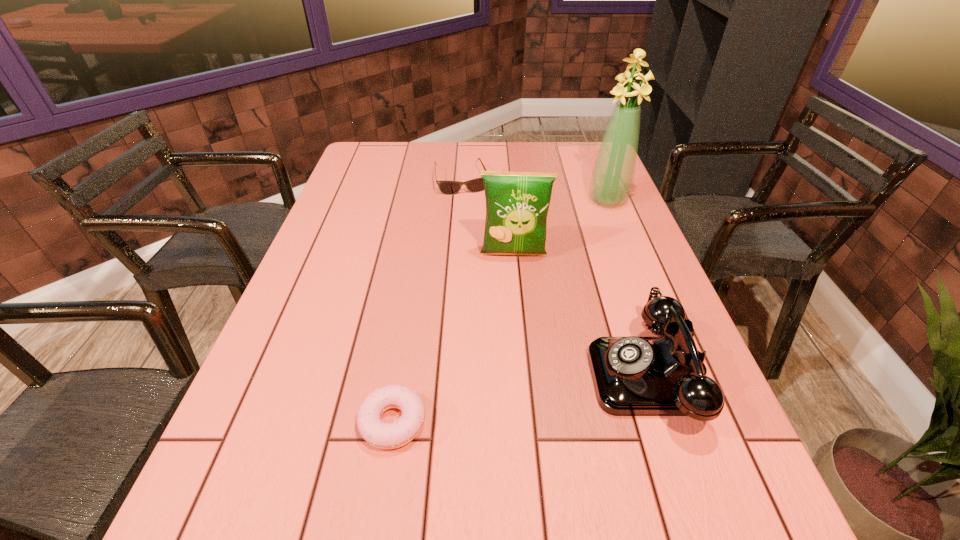
Locate an element on the screen. This screenshot has width=960, height=540. vacant region that satisfies the following two spatial constraints: 1. on the front side of the tallest object; 2. on the left side of the sunglasses is located at coordinates (461, 201).

Locate an element on the screen. The width and height of the screenshot is (960, 540). free spot that satisfies the following two spatial constraints: 1. on the back side of the tallest object; 2. on the left side of the doughnut is located at coordinates (428, 201).